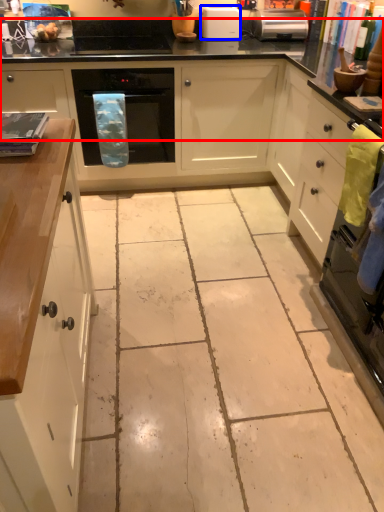
Question: Which object is closer to the camera taking this photo, countertop (highlighted by a red box) or kitchen appliance (highlighted by a blue box)?

Choices:
 (A) countertop
 (B) kitchen appliance

Answer: (A)